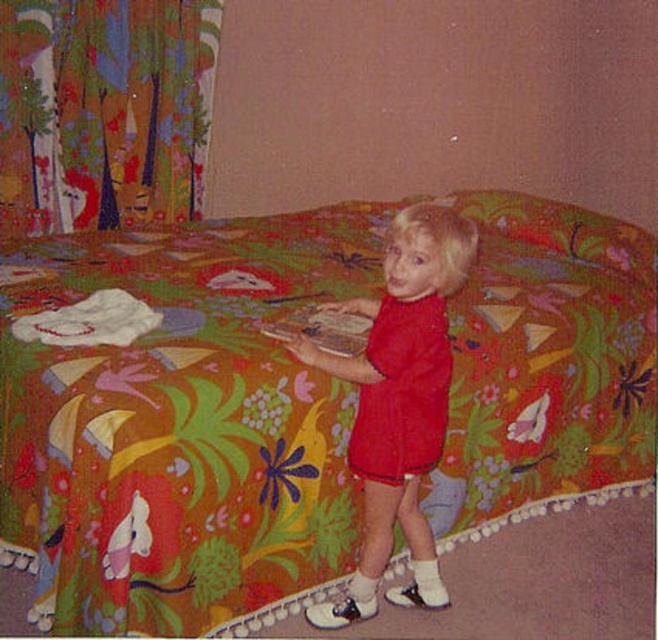
Is floral fabric bed at center thinner than multicolored fabric curtain at upper left?

In fact, floral fabric bed at center might be wider than multicolored fabric curtain at upper left.

Is floral fabric bed at center positioned behind multicolored fabric curtain at upper left?

No, it is not.

Locate an element on the screen. floral fabric bed at center is located at coordinates (180, 426).

Does multicolored fabric curtain at upper left have a larger size compared to matte red dress at center?

Yes, multicolored fabric curtain at upper left is bigger than matte red dress at center.

Is multicolored fabric curtain at upper left further to the viewer compared to matte red dress at center?

Yes.

Looking at this image, who is more distant from viewer, (109, 161) or (316, 365)?

The point (109, 161) is behind.

In order to click on multicolored fabric curtain at upper left in this screenshot , I will do `click(103, 112)`.

Is point (266, 301) behind point (442, 348)?

Yes, point (266, 301) is farther from viewer.

Is the position of floral fabric bed at center more distant than that of matte red dress at center?

No, it is in front of matte red dress at center.

Is point (266, 452) behind point (376, 499)?

That is False.

What are the coordinates of `floral fabric bed at center` in the screenshot? It's located at (180, 426).